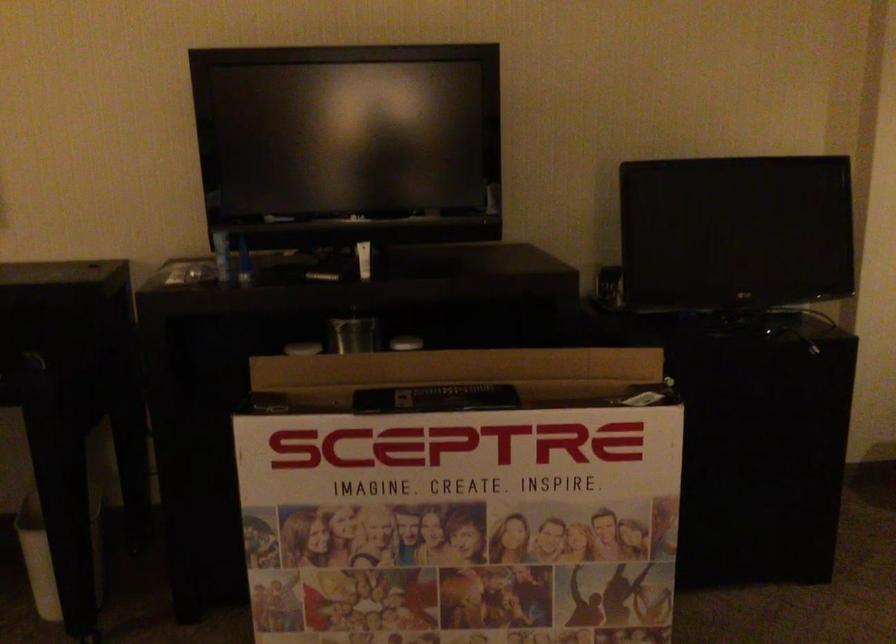
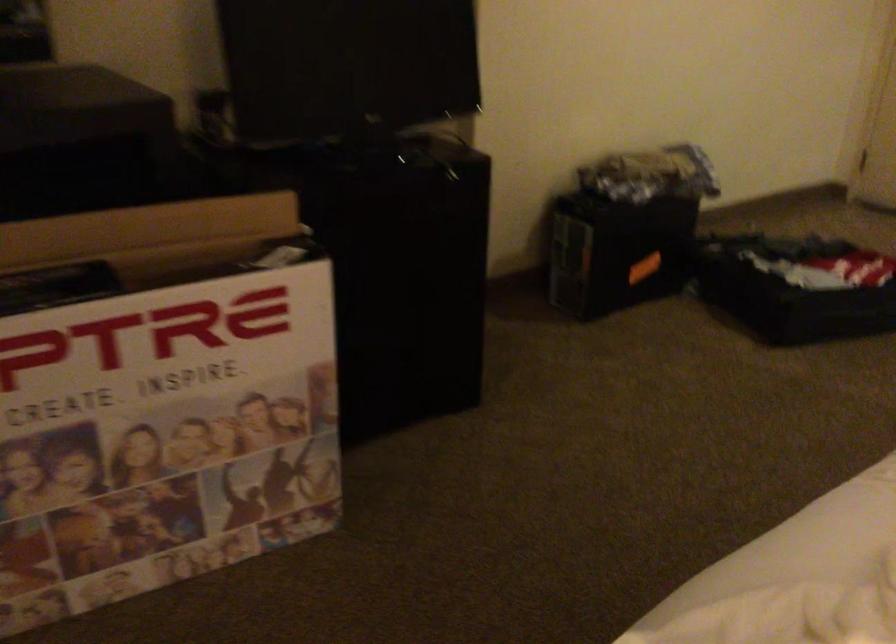
Find the pixel in the second image that matches pixel 540 491 in the first image.

(171, 393)